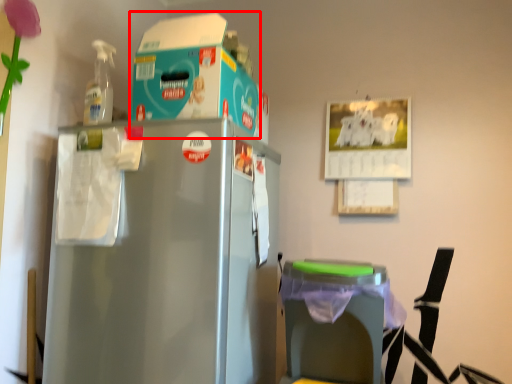
Question: Observing the image, what is the correct spatial positioning of storage box (annotated by the red box) in reference to table?

Choices:
 (A) left
 (B) right

Answer: (A)